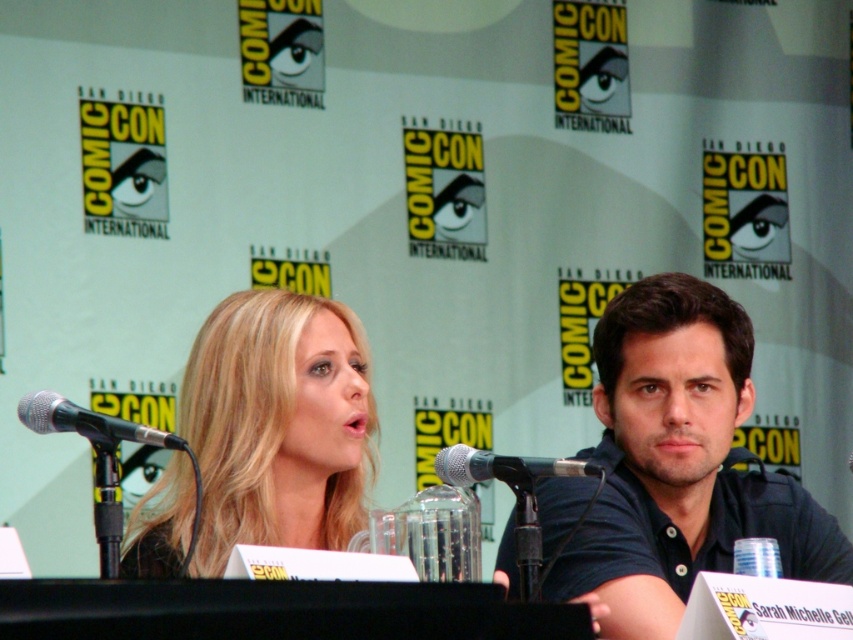
You are standing at the point marked as point (279, 529) in the Comic Con panel discussion room. You want to take a photo of the panelists using a camera that has a maximum focus range of 3 meters. Can you capture a clear photo of the panelists from this position?

The distance between point (279, 529) and the camera is 2.80 meters, which is within the camera maximum focus range of 3 meters. Therefore, you can capture a clear photo of the panelists from this position.

You are a photographer at the event and want to capture a clear shot of the dark blue polo shirt at center without the black metallic microphone at center blocking it. How should you adjust your camera angle?

The black metallic microphone at center is behind the dark blue polo shirt at center, so you can move your camera angle slightly forward to ensure the dark blue polo shirt at center is in focus while the microphone is out of frame.

You are attending a panel discussion at Comic Con and want to take a photo of the speaker at point (743, 532). The camera you have can focus on objects up to 3 meters away. Will the speaker be in focus?

The distance between point (743, 532) and the viewer is 3.10 meters. Since the camera can focus up to 3 meters, the speaker will be slightly out of focus.